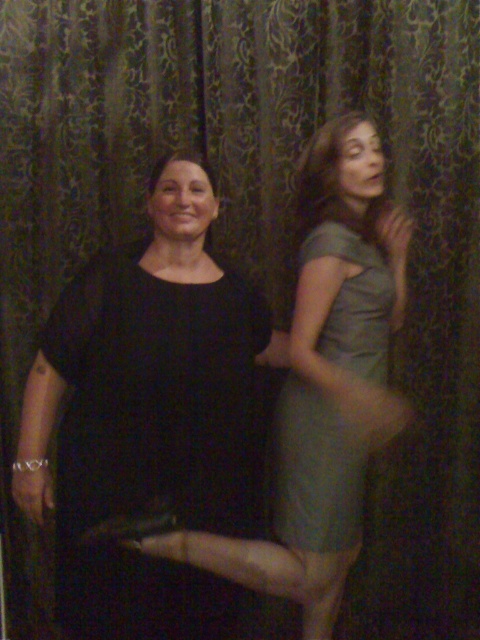
You are a fashion designer who needs to determine which dress requires more fabric based on the image. Which dress from the options would need more fabric, the matte gray dress at center or the satin green dress at right?

The matte gray dress at center requires more fabric than the satin green dress at right because it is larger in size.

You are a fashion designer trying to place a necklace between the matte gray dress at center and the satin green dress at right. Can you fit a necklace that is 2 inches long between them?

The distance between the matte gray dress at center and the satin green dress at right is 1.90 inches, which is shorter than the necklace length of 2 inches. Therefore, the necklace cannot fit between them.